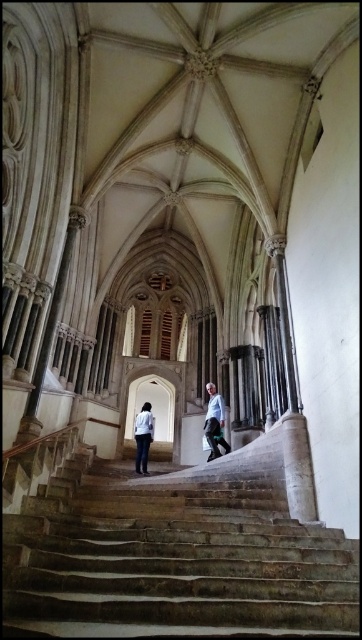
Is point (34, 628) positioned behind point (226, 445)?

No, it is not.

Is stone stairs at center above green fabric pants at center?

No, stone stairs at center is not above green fabric pants at center.

Image resolution: width=362 pixels, height=640 pixels. Describe the element at coordinates (175, 554) in the screenshot. I see `stone stairs at center` at that location.

The width and height of the screenshot is (362, 640). I want to click on stone stairs at center, so click(175, 554).

Can you confirm if green fabric pants at center is smaller than light blue shirt at center?

Correct, green fabric pants at center occupies less space than light blue shirt at center.

Is green fabric pants at center wider than light blue shirt at center?

Incorrect, green fabric pants at center's width does not surpass light blue shirt at center's.

Image resolution: width=362 pixels, height=640 pixels. What are the coordinates of `green fabric pants at center` in the screenshot? It's located at click(x=215, y=422).

Does stone stairs at center have a smaller size compared to light blue shirt at center?

Actually, stone stairs at center might be larger than light blue shirt at center.

Can you confirm if stone stairs at center is positioned below light blue shirt at center?

No, stone stairs at center is not below light blue shirt at center.

Does point (325, 586) lie in front of point (144, 417)?

Yes, it is in front of point (144, 417).

Locate an element on the screen. stone stairs at center is located at coordinates (175, 554).